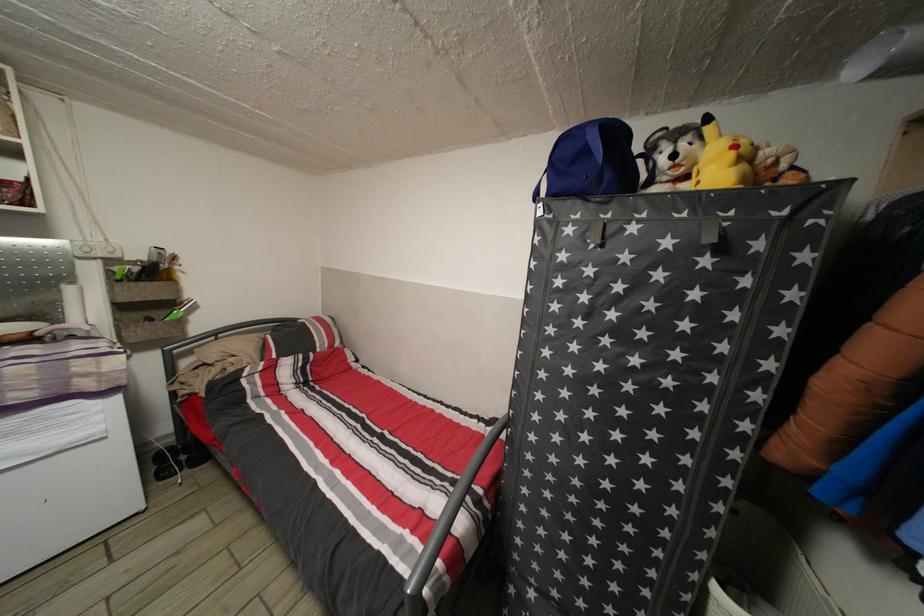
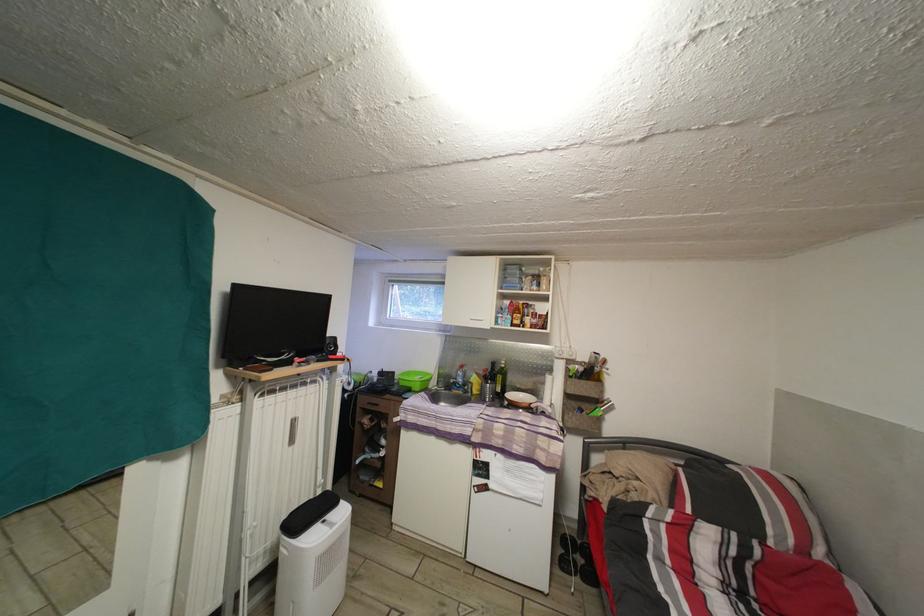
Question: The camera is either moving clockwise (left) or counter-clockwise (right) around the object. The first image is from the beginning of the video and the second image is from the end. Is the camera moving left or right when shooting the video?

Choices:
 (A) Left
 (B) Right

Answer: (B)